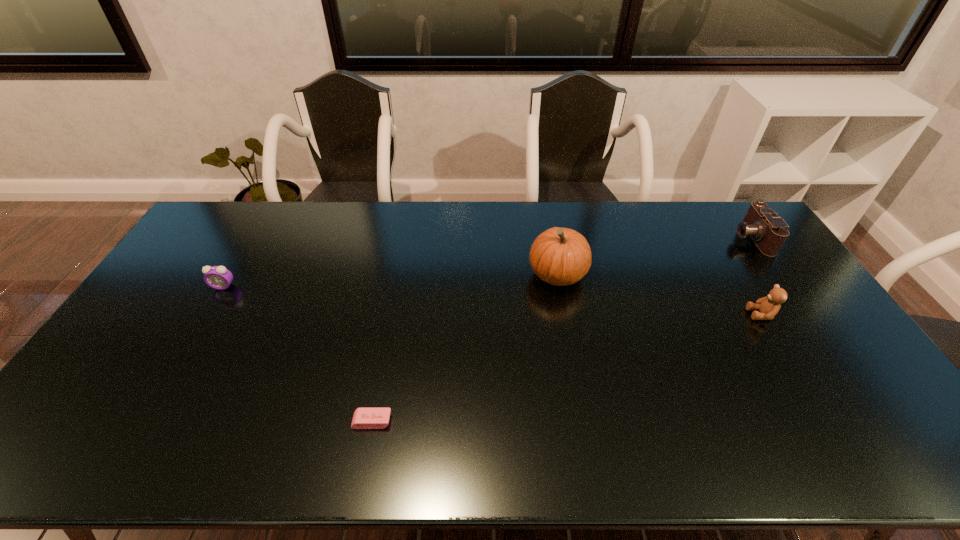
Where is `object that is at the far edge`? The width and height of the screenshot is (960, 540). object that is at the far edge is located at coordinates tap(769, 232).

I want to click on camera that is at the right edge, so click(769, 232).

You are a GUI agent. You are given a task and a screenshot of the screen. Output one action in this format:
    pyautogui.click(x=<x>, y=<y>)
    Task: Click on the teddy bear located in the right edge section of the desktop
    This screenshot has height=540, width=960.
    Given the screenshot: What is the action you would take?
    pyautogui.click(x=768, y=307)

At what (x,y) coordinates should I click in order to perform the action: click on object that is positioned at the far right corner. Please return your answer as a coordinate pair (x, y). Looking at the image, I should click on (769, 232).

Identify the location of vacant point at the far edge. (344, 208).

Identify the location of vacant space at the left edge of the desktop. This screenshot has width=960, height=540. (211, 265).

This screenshot has height=540, width=960. What are the coordinates of `vacant space at the right edge of the desktop` in the screenshot? It's located at (825, 330).

Where is `free space between the fourth object from right to left and the leftmost object`? free space between the fourth object from right to left and the leftmost object is located at coordinates (298, 354).

Locate an element on the screen. This screenshot has width=960, height=540. unoccupied position between the fourth object from right to left and the rightmost object is located at coordinates (562, 329).

Where is `free space between the teddy bear and the pumpkin`? Image resolution: width=960 pixels, height=540 pixels. free space between the teddy bear and the pumpkin is located at coordinates (660, 294).